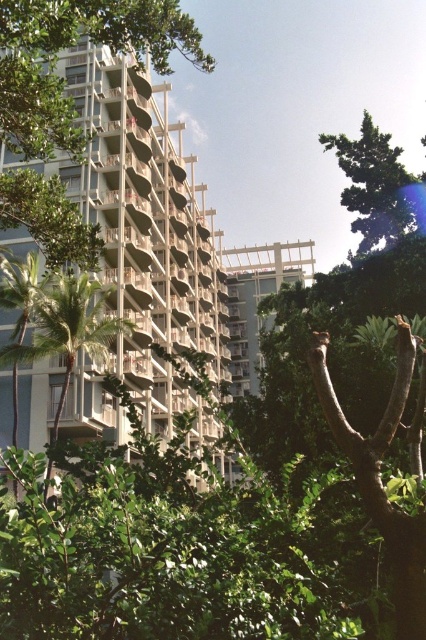
Question: Which object is positioned closest to the green leafy tree at left?

Choices:
 (A) white textured building at center
 (B) green leafy tree at upper right

Answer: (A)

Question: Is white textured building at center thinner than green leafy tree at upper right?

Choices:
 (A) no
 (B) yes

Answer: (A)

Question: Does white textured building at center appear over green leafy tree at upper right?

Choices:
 (A) no
 (B) yes

Answer: (A)

Question: Among these objects, which one is nearest to the camera?

Choices:
 (A) green leafy tree at left
 (B) green leafy tree at upper right

Answer: (A)

Question: From the image, what is the correct spatial relationship of white textured building at center in relation to green leafy tree at upper right?

Choices:
 (A) left
 (B) right

Answer: (A)

Question: Which object appears closest to the camera in this image?

Choices:
 (A) green leafy tree at left
 (B) green leafy tree at upper right
 (C) white textured building at center

Answer: (A)